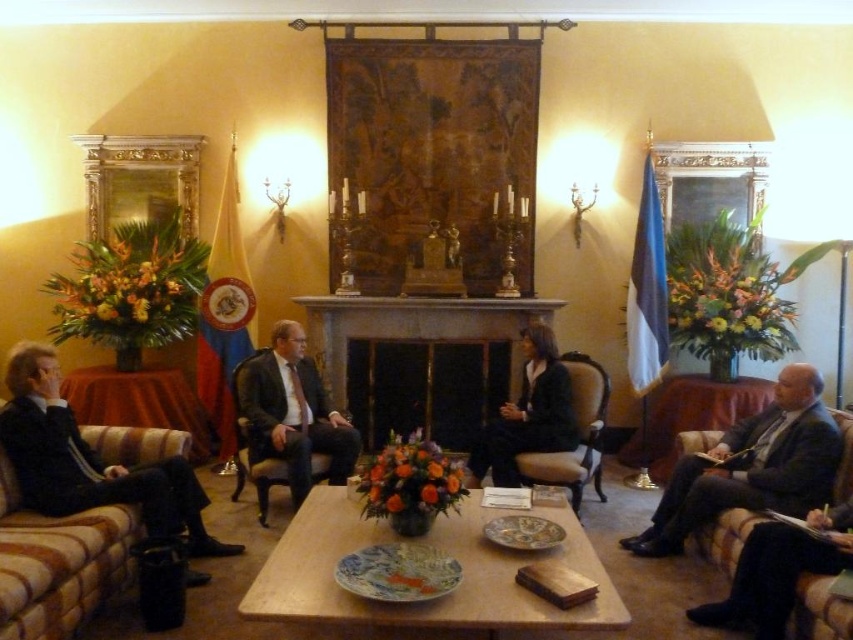
Question: Does dark suit at right appear over dark brown leather armchair at center?

Choices:
 (A) no
 (B) yes

Answer: (A)

Question: Estimate the real-world distances between objects in this image. Which object is farther from the brown leather couch at lower right?

Choices:
 (A) dark suit at right
 (B) white stone fireplace at center

Answer: (B)

Question: Can you confirm if dark suit at right is wider than brown leather couch at lower right?

Choices:
 (A) no
 (B) yes

Answer: (B)

Question: Is white stone fireplace at center thinner than dark brown leather armchair at center?

Choices:
 (A) no
 (B) yes

Answer: (A)

Question: Which object is closer to the camera taking this photo?

Choices:
 (A) striped fabric couch at left
 (B) matte black suit at center
 (C) brown leather couch at lower right
 (D) white stone fireplace at center

Answer: (A)

Question: Which of the following is the farthest from the observer?

Choices:
 (A) striped fabric couch at left
 (B) white stone fireplace at center

Answer: (B)